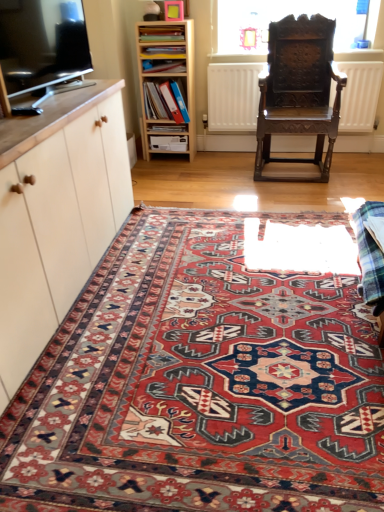
The width and height of the screenshot is (384, 512). Find the location of `free space in front of light wood shelf at upper center`. free space in front of light wood shelf at upper center is located at coordinates point(177,165).